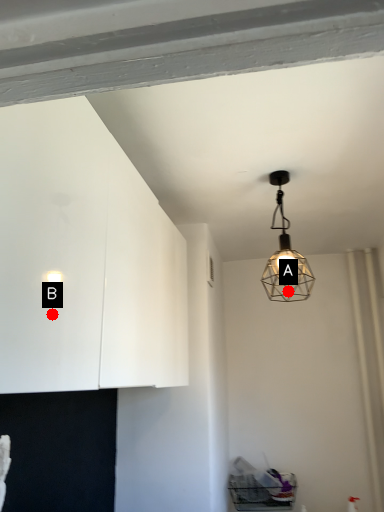
Question: Two points are circled on the image, labeled by A and B beside each circle. Among these points, which one is nearest to the camera?

Choices:
 (A) A is closer
 (B) B is closer

Answer: (B)